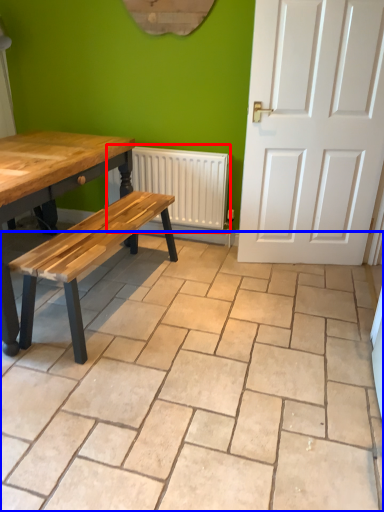
Question: Which of the following is the farthest to the observer, radiator (highlighted by a red box) or ceramic tile (highlighted by a blue box)?

Choices:
 (A) radiator
 (B) ceramic tile

Answer: (A)